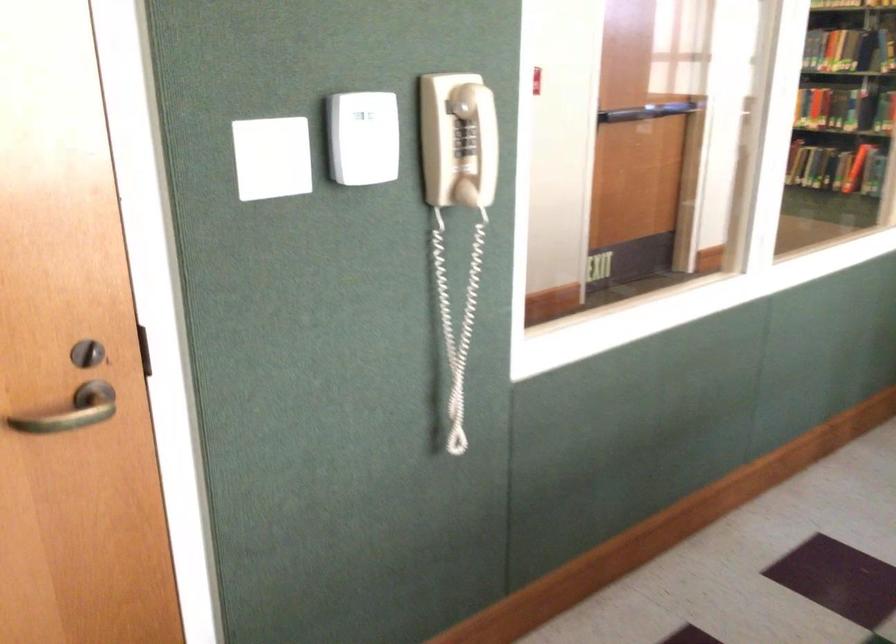
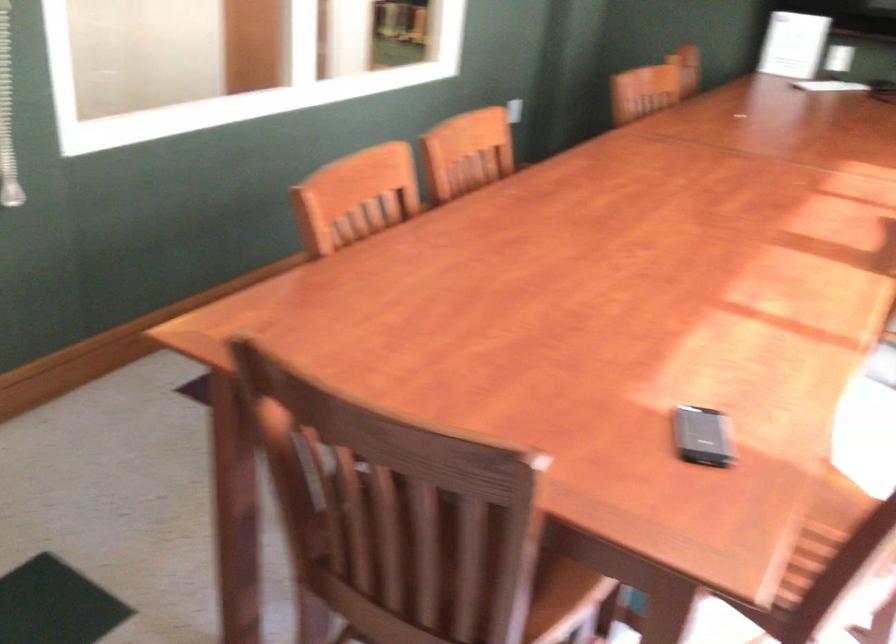
Question: The camera is either moving clockwise (left) or counter-clockwise (right) around the object. The first image is from the beginning of the video and the second image is from the end. Is the camera moving left or right when shooting the video?

Choices:
 (A) Left
 (B) Right

Answer: (A)